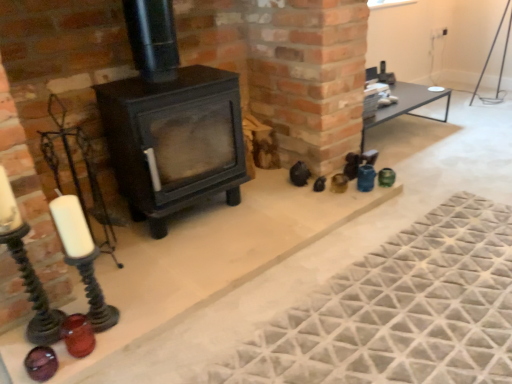
Question: Should I look upward or downward to see textured gray mat at lower right?

Choices:
 (A) down
 (B) up

Answer: (A)

Question: Can you confirm if matte black stove at center is thinner than textured gray mat at lower right?

Choices:
 (A) yes
 (B) no

Answer: (B)

Question: Does matte black stove at center appear on the left side of textured gray mat at lower right?

Choices:
 (A) no
 (B) yes

Answer: (A)

Question: From the image's perspective, would you say matte black stove at center is positioned over textured gray mat at lower right?

Choices:
 (A) yes
 (B) no

Answer: (A)

Question: From a real-world perspective, is matte black stove at center located higher than textured gray mat at lower right?

Choices:
 (A) no
 (B) yes

Answer: (B)

Question: Is matte black stove at center far from textured gray mat at lower right?

Choices:
 (A) no
 (B) yes

Answer: (B)

Question: Is matte black stove at center completely or partially outside of textured gray mat at lower right?

Choices:
 (A) yes
 (B) no

Answer: (A)

Question: From a real-world perspective, is matte black wood burning stove at center under translucent amber glass candle holder at lower left?

Choices:
 (A) no
 (B) yes

Answer: (A)

Question: Can you confirm if matte black wood burning stove at center is positioned to the left of translucent amber glass candle holder at lower left?

Choices:
 (A) no
 (B) yes

Answer: (A)

Question: From the image's perspective, is matte black wood burning stove at center under translucent amber glass candle holder at lower left?

Choices:
 (A) no
 (B) yes

Answer: (A)

Question: Could you tell me if matte black wood burning stove at center is facing translucent amber glass candle holder at lower left?

Choices:
 (A) yes
 (B) no

Answer: (B)

Question: Is matte black wood burning stove at center in front of translucent amber glass candle holder at lower left?

Choices:
 (A) no
 (B) yes

Answer: (A)

Question: Is matte black wood burning stove at center located outside translucent amber glass candle holder at lower left?

Choices:
 (A) no
 (B) yes

Answer: (B)

Question: Considering the relative sizes of textured gray mat at lower right and translucent amber glass candle holder at lower left in the image provided, is textured gray mat at lower right shorter than translucent amber glass candle holder at lower left?

Choices:
 (A) no
 (B) yes

Answer: (B)